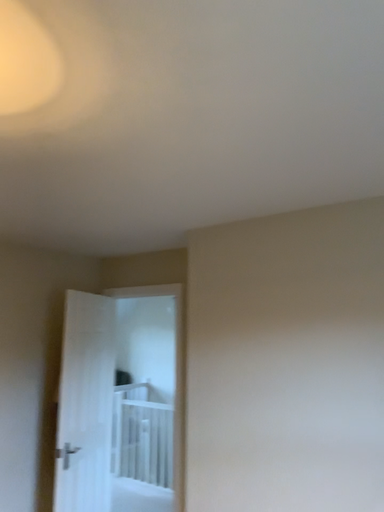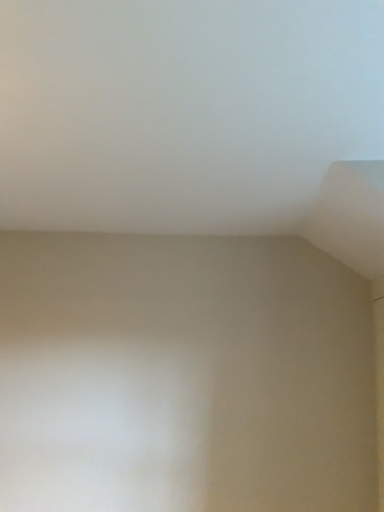
Question: How did the camera likely rotate when shooting the video?

Choices:
 (A) rotated right
 (B) rotated left

Answer: (A)